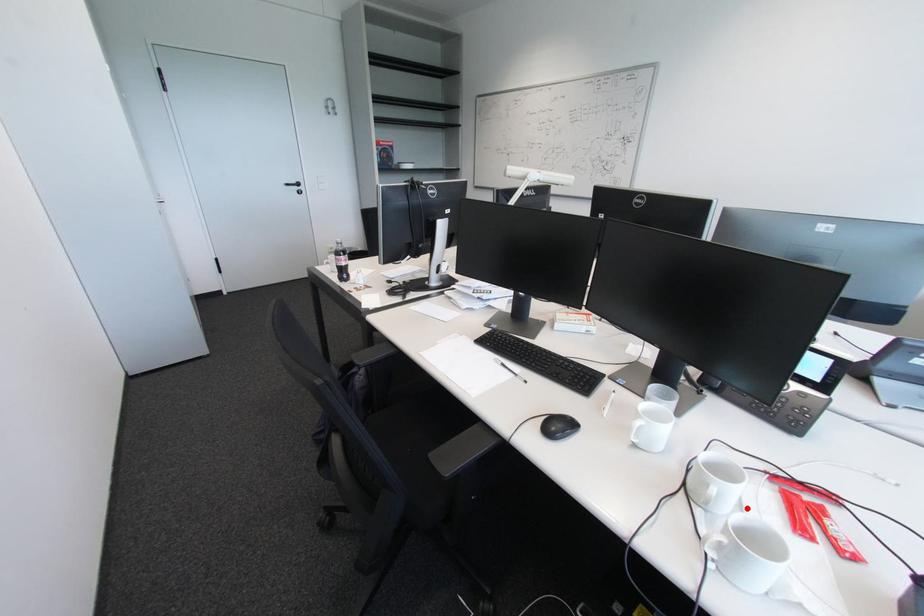
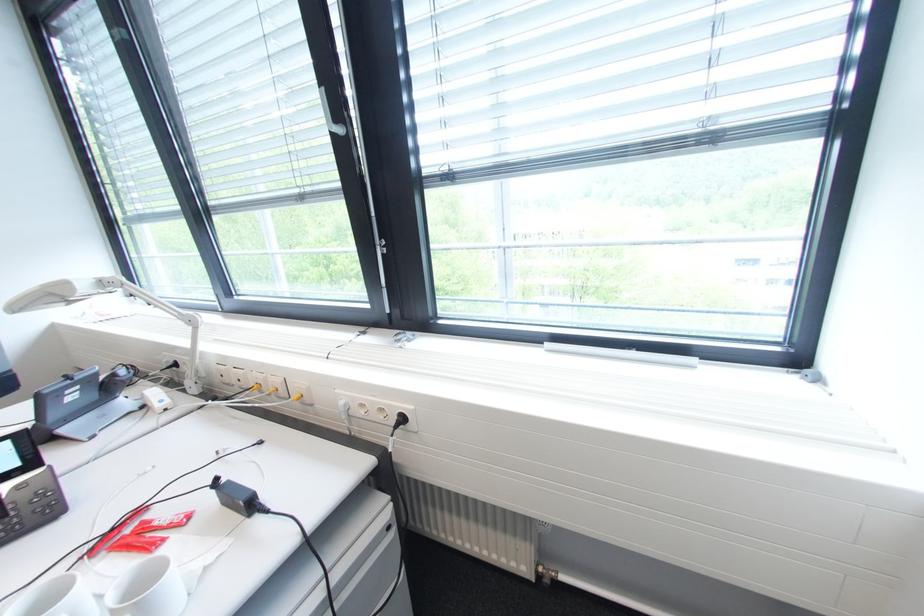
The point at the highlighted location is marked in the first image. Where is the corresponding point in the second image?

(106, 599)